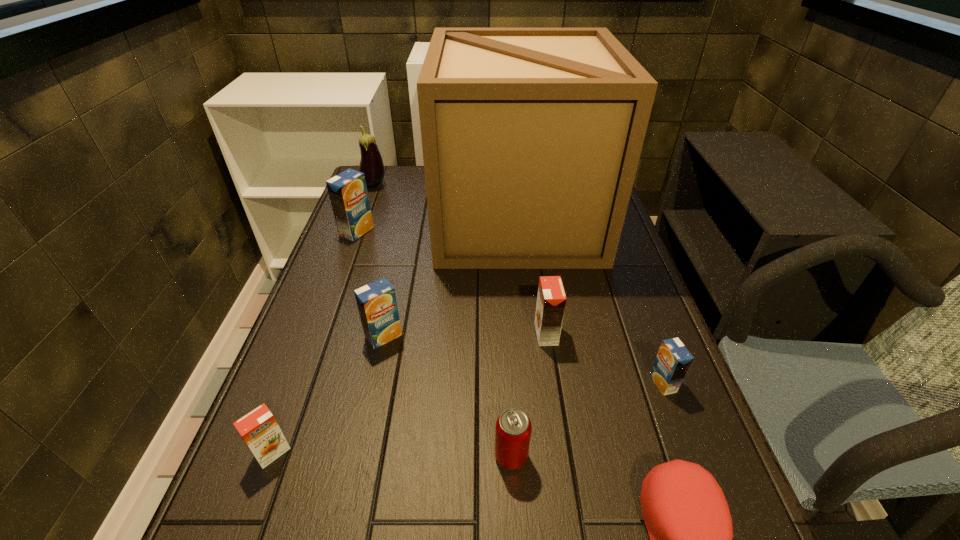
Locate an element on the screen. the smallest blue orange_juice is located at coordinates (673, 360).

Image resolution: width=960 pixels, height=540 pixels. Find the location of `the smaller orange orange juice`. the smaller orange orange juice is located at coordinates pos(259,429).

This screenshot has height=540, width=960. Identify the location of the nearer orange orange juice. (259, 429).

Locate an element on the screen. free space located 0.270m on the reinforced sides of the tallest object is located at coordinates (352, 219).

Where is `blank area located on the reinforced sides of the tallest object`? blank area located on the reinforced sides of the tallest object is located at coordinates (358, 219).

At what (x,y) coordinates should I click in order to perform the action: click on vacant space located on the reinforced sides of the tallest object. Please return your answer as a coordinate pair (x, y). This screenshot has height=540, width=960. Looking at the image, I should click on (362, 219).

The height and width of the screenshot is (540, 960). I want to click on free spot located 0.240m on the front of the eggplant, so (356, 233).

You are a GUI agent. You are given a task and a screenshot of the screen. Output one action in this format:
    pyautogui.click(x=<x>, y=<y>)
    Task: Click on the vacant area situated 0.300m on the right of the farthest orange juice
    The width and height of the screenshot is (960, 540).
    Given the screenshot: What is the action you would take?
    pyautogui.click(x=473, y=232)

In order to click on free space located on the back of the fourth orange juice from left to right in this screenshot , I will do `click(540, 293)`.

This screenshot has height=540, width=960. I want to click on vacant space located on the right of the third orange juice from left to right, so click(512, 336).